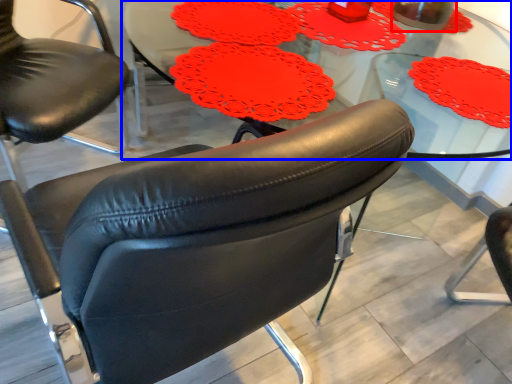
Question: Which object appears closest to the camera in this image, beverage (highlighted by a red box) or table (highlighted by a blue box)?

Choices:
 (A) beverage
 (B) table

Answer: (B)